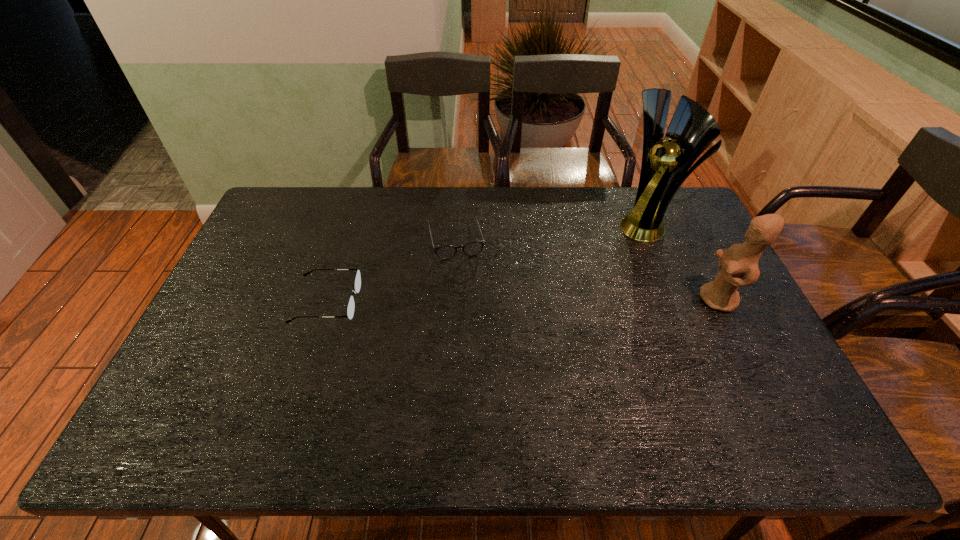
This screenshot has height=540, width=960. In order to click on vacant point located between the farther spectacles and the figurine in this screenshot , I will do `click(587, 269)`.

Locate an element on the screen. This screenshot has width=960, height=540. vacant point located between the nearer spectacles and the right spectacles is located at coordinates (391, 271).

You are a GUI agent. You are given a task and a screenshot of the screen. Output one action in this format:
    pyautogui.click(x=<x>, y=<y>)
    Task: Click on the vacant area that lies between the figurine and the award
    This screenshot has height=540, width=960.
    Given the screenshot: What is the action you would take?
    pyautogui.click(x=684, y=262)

Where is `free space between the figurine and the leftmost object`? The height and width of the screenshot is (540, 960). free space between the figurine and the leftmost object is located at coordinates (523, 301).

Where is `free space between the award and the second tallest object`? The height and width of the screenshot is (540, 960). free space between the award and the second tallest object is located at coordinates (684, 262).

This screenshot has height=540, width=960. I want to click on blank region between the third shortest object and the nearer spectacles, so click(523, 301).

Identify which object is the nearest to the award. Please provide its 2D coordinates. Your answer should be formatted as a tuple, i.e. [(x, y)], where the tuple contains the x and y coordinates of a point satisfying the conditions above.

[(739, 260)]

Locate an element on the screen. object that is the closest to the figurine is located at coordinates coord(665,165).